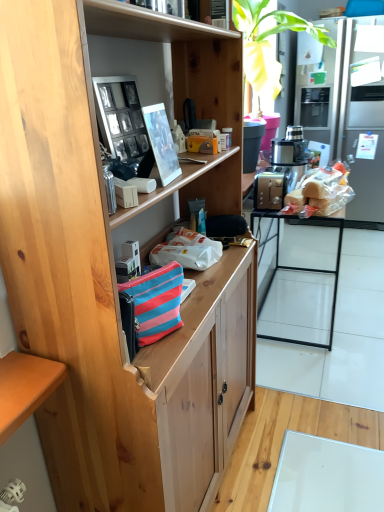
Question: From a real-world perspective, is silver metallic refrigerator at right below striped fabric handbag at center?

Choices:
 (A) no
 (B) yes

Answer: (A)

Question: Is silver metallic refrigerator at right wider than striped fabric handbag at center?

Choices:
 (A) yes
 (B) no

Answer: (A)

Question: From a real-world perspective, is silver metallic refrigerator at right over striped fabric handbag at center?

Choices:
 (A) yes
 (B) no

Answer: (A)

Question: Is silver metallic refrigerator at right facing towards striped fabric handbag at center?

Choices:
 (A) yes
 (B) no

Answer: (A)

Question: From the image's perspective, is silver metallic refrigerator at right below striped fabric handbag at center?

Choices:
 (A) no
 (B) yes

Answer: (A)

Question: Does point (365, 90) appear closer or farther from the camera than point (34, 278)?

Choices:
 (A) closer
 (B) farther

Answer: (B)

Question: Considering the positions of silver metallic refrigerator at right and wooden cabinet at center in the image, is silver metallic refrigerator at right bigger or smaller than wooden cabinet at center?

Choices:
 (A) small
 (B) big

Answer: (B)

Question: Is silver metallic refrigerator at right taller or shorter than wooden cabinet at center?

Choices:
 (A) short
 (B) tall

Answer: (B)

Question: In terms of width, does silver metallic refrigerator at right look wider or thinner when compared to wooden cabinet at center?

Choices:
 (A) wide
 (B) thin

Answer: (A)

Question: From the image's perspective, is white glossy table at center located above or below striped fabric handbag at center?

Choices:
 (A) above
 (B) below

Answer: (B)

Question: Is white glossy table at center in front of or behind striped fabric handbag at center in the image?

Choices:
 (A) front
 (B) behind

Answer: (B)

Question: Based on their positions, is white glossy table at center located to the left or right of striped fabric handbag at center?

Choices:
 (A) left
 (B) right

Answer: (B)

Question: Looking at their shapes, would you say white glossy table at center is wider or thinner than striped fabric handbag at center?

Choices:
 (A) wide
 (B) thin

Answer: (A)

Question: Is matte plastic picture frame at upper center, acting as the second picture frame starting from the left, inside or outside of wooden cabinet at center?

Choices:
 (A) inside
 (B) outside

Answer: (A)

Question: Is point click(178, 173) closer or farther from the camera than point click(210, 103)?

Choices:
 (A) closer
 (B) farther

Answer: (A)